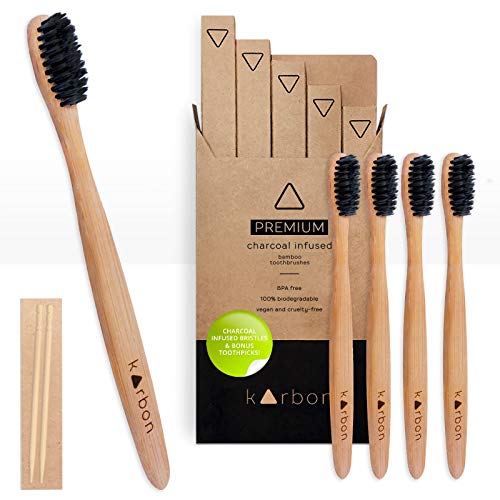
Identify the location of tooth brushes. Image resolution: width=500 pixels, height=500 pixels. (94, 212), (344, 320), (371, 334), (417, 343), (455, 355).